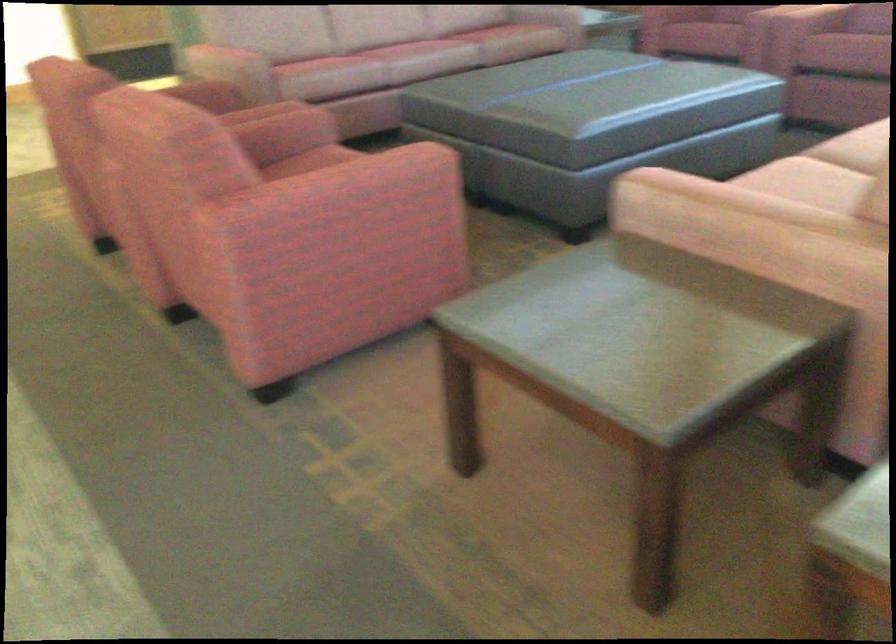
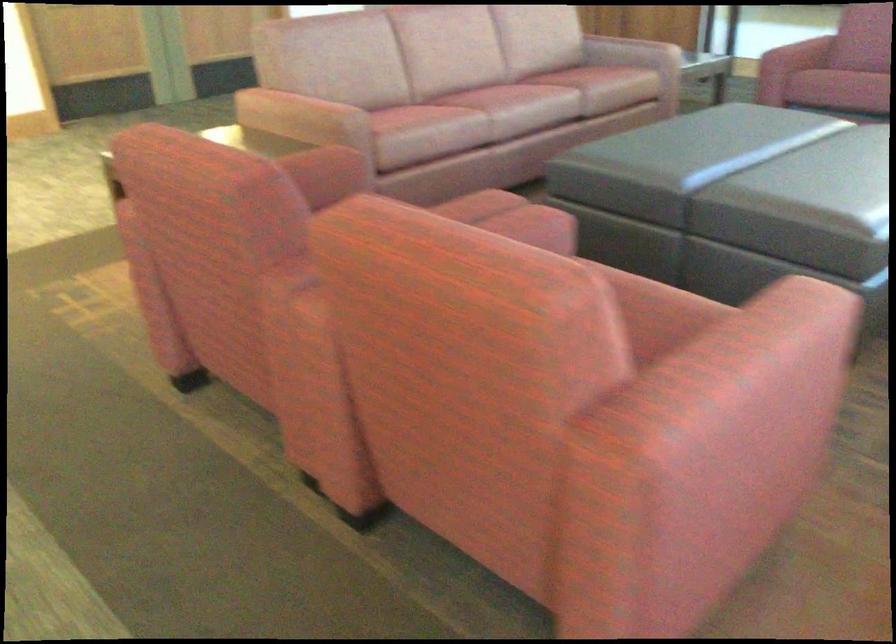
What movement of the cameraman would produce the second image?

The cameraman moved toward left, forward.